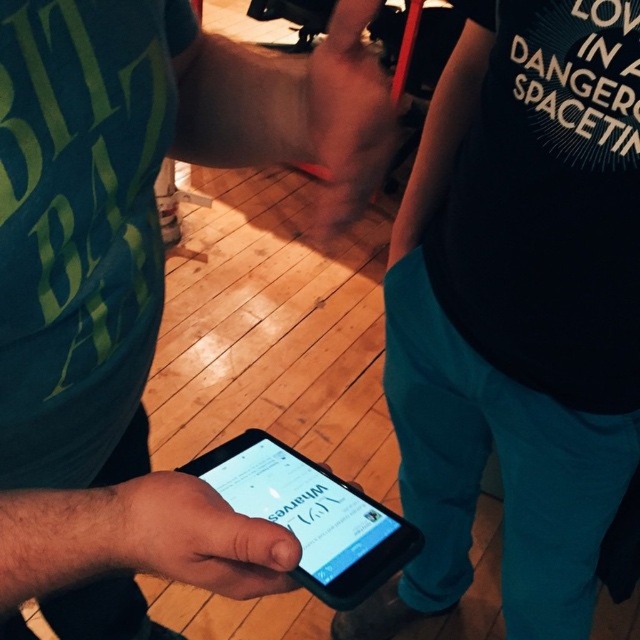
You are a person trying to take a photo of the black matte phone at center and the matte skin hand at center. Which object should you position to the left to frame the photo properly?

The black matte phone at center should be positioned to the left of the matte skin hand at center because the black matte phone at center is already on the left side of the matte skin hand at center in the image.

You are a photographer trying to capture a clear shot of both the black matte shirt at center and the black matte phone at center. Since the phone is important for the story, you want to ensure it is visible. Based on their positions, which object is closer to you and might block the view of the other?

The black matte shirt at center is closer to you than the black matte phone at center, so it might block the view of the phone if not positioned carefully.